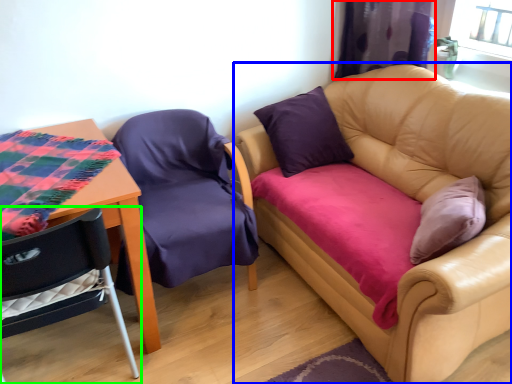
Question: Based on their relative distances, which object is nearer to curtain (highlighted by a red box)? Choose from studio couch (highlighted by a blue box) and chair (highlighted by a green box).

Choices:
 (A) studio couch
 (B) chair

Answer: (A)